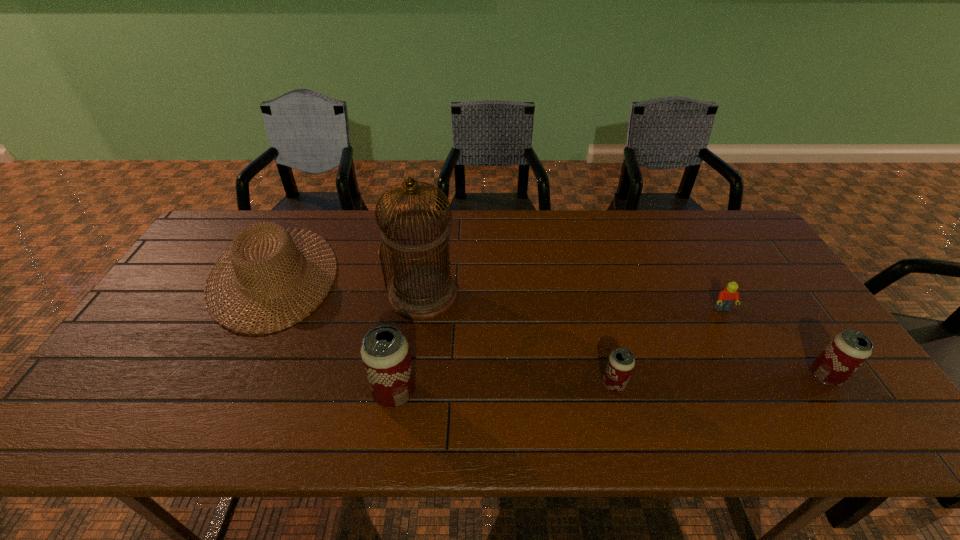
Where is `vacant area between the birdcage and the Lego`? vacant area between the birdcage and the Lego is located at coordinates (573, 302).

At what (x,y) coordinates should I click in order to perform the action: click on unoccupied position between the rightmost object and the tallest object. Please return your answer as a coordinate pair (x, y). Looking at the image, I should click on (625, 335).

Locate an element on the screen. The height and width of the screenshot is (540, 960). vacant space that's between the fourth object from left to right and the leftmost beer can is located at coordinates (504, 388).

The image size is (960, 540). Find the location of `free spot between the fourth object from left to right and the Lego`. free spot between the fourth object from left to right and the Lego is located at coordinates (668, 347).

Locate an element on the screen. This screenshot has width=960, height=540. vacant region between the leftmost object and the third object from right to left is located at coordinates (444, 330).

Select which object is the fifth closest to the second tallest object. Please provide its 2D coordinates. Your answer should be formatted as a tuple, i.e. [(x, y)], where the tuple contains the x and y coordinates of a point satisfying the conditions above.

[(847, 351)]

Locate an element on the screen. The height and width of the screenshot is (540, 960). object that stands as the second closest to the birdcage is located at coordinates (385, 353).

Select which beer can appears as the closest to the sunhat. Please provide its 2D coordinates. Your answer should be formatted as a tuple, i.e. [(x, y)], where the tuple contains the x and y coordinates of a point satisfying the conditions above.

[(385, 353)]

Locate which beer can is the closest to the leftmost beer can. Please provide its 2D coordinates. Your answer should be formatted as a tuple, i.e. [(x, y)], where the tuple contains the x and y coordinates of a point satisfying the conditions above.

[(621, 362)]

I want to click on vacant space that satisfies the following two spatial constraints: 1. on the front-facing side of the tallest object; 2. on the right side of the second beer can from right to left, so click(412, 384).